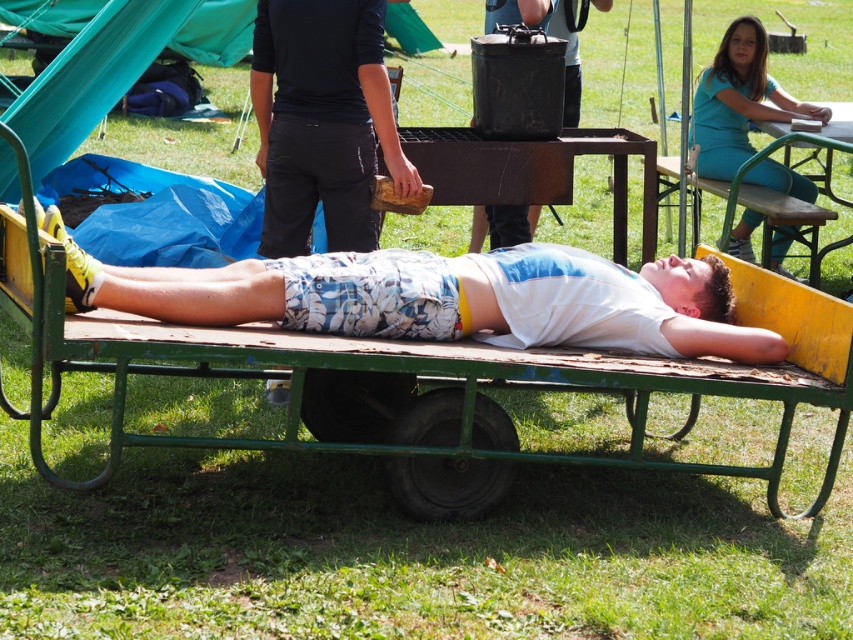
Where is the black matte pants at center located in the image?

The black matte pants at center is located at point (x=322, y=122) in the image.

You are a photographer setting up a shot of the green metal wagon at center and the teal fabric pants at upper right. To ensure both are in frame, where should you position your camera?

Position the camera above the green metal wagon at center so that it can capture both the wagon and the teal fabric pants at upper right, which are located above it.